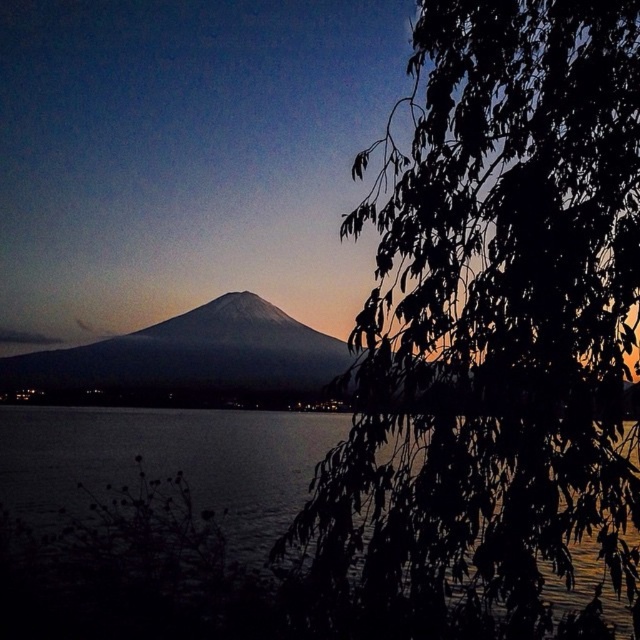
Question: Can you confirm if green leafy branch at right is smaller than gray matte mountain at center?

Choices:
 (A) no
 (B) yes

Answer: (B)

Question: Does green leafy branch at right appear on the left side of dark water at lower left?

Choices:
 (A) no
 (B) yes

Answer: (A)

Question: Which of the following is the closest to the observer?

Choices:
 (A) (588, 154)
 (B) (257, 456)

Answer: (A)

Question: Which point is closer to the camera?

Choices:
 (A) dark water at lower left
 (B) green leafy branch at right

Answer: (B)

Question: Which of these objects is positioned farthest from the green leafy branch at right?

Choices:
 (A) dark water at lower left
 (B) gray matte mountain at center

Answer: (A)

Question: Can you confirm if green leafy branch at right is bigger than gray matte mountain at center?

Choices:
 (A) yes
 (B) no

Answer: (B)